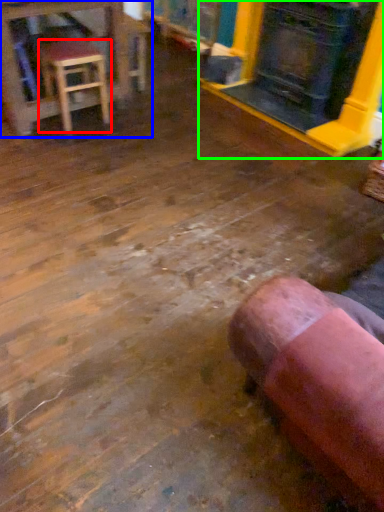
Question: Estimate the real-world distances between objects in this image. Which object is farther from stool (highlighted by a red box), table (highlighted by a blue box) or fireplace (highlighted by a green box)?

Choices:
 (A) table
 (B) fireplace

Answer: (B)